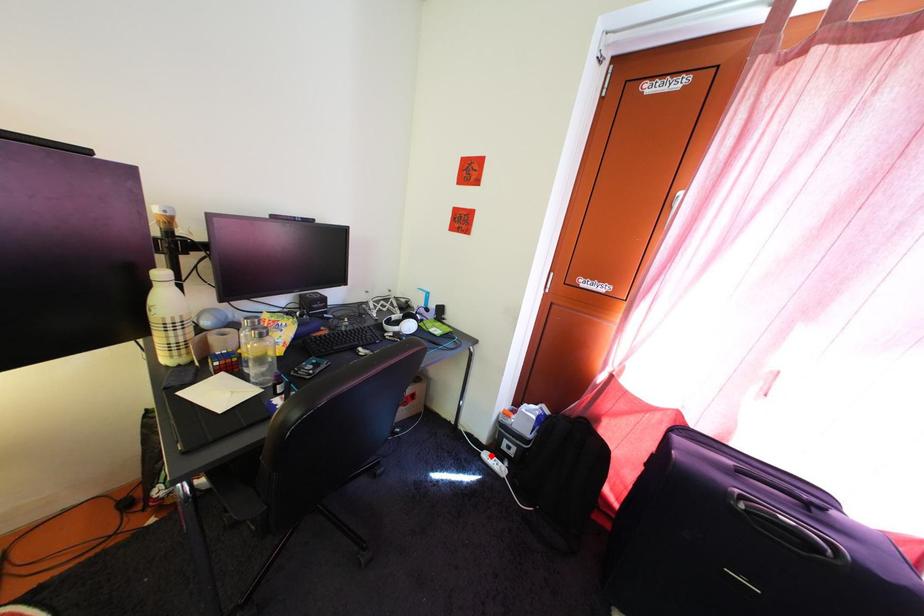
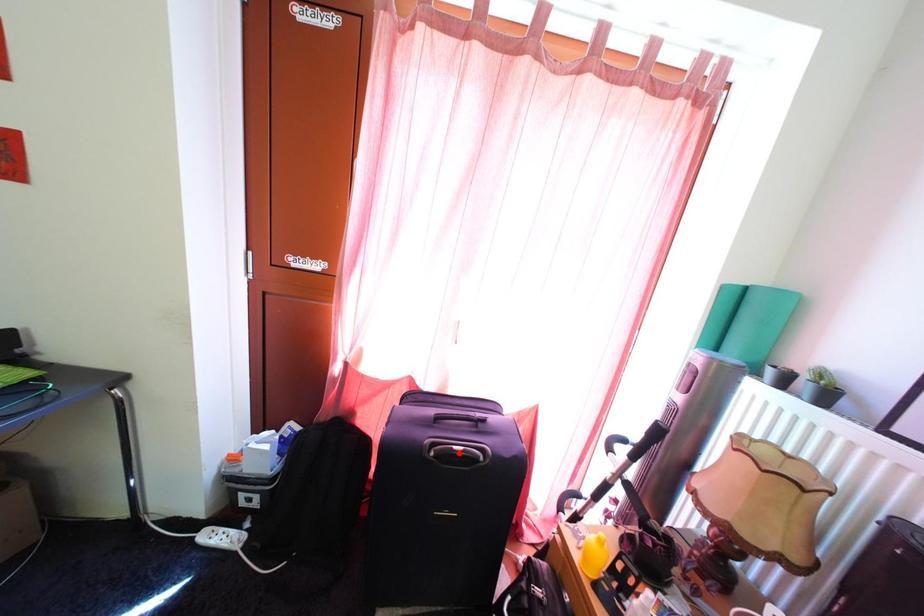
I am providing you with two images of the same scene from different viewpoints. A red point is marked on the first image and another point is marked on the second image. Do the highlighted points in image1 and image2 indicate the same real-world spot?

No